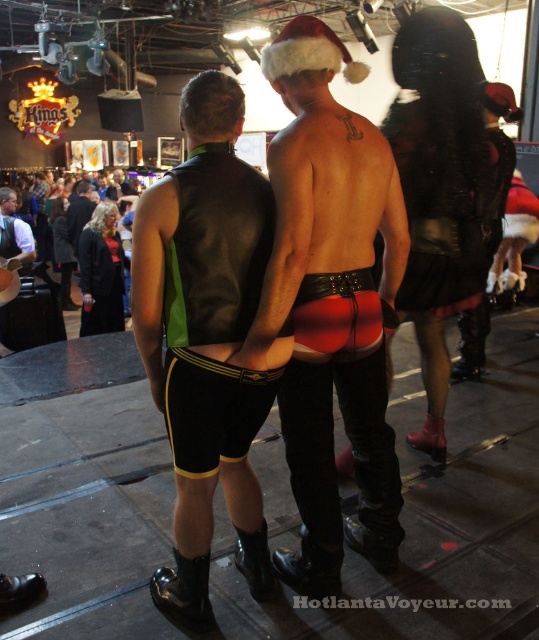
Question: Does shiny leather shorts at center have a smaller size compared to black leather vest at center?

Choices:
 (A) no
 (B) yes

Answer: (A)

Question: Is shiny leather shorts at center positioned before black leather vest at center?

Choices:
 (A) no
 (B) yes

Answer: (A)

Question: Which point is farther from the camera taking this photo?

Choices:
 (A) (233, 428)
 (B) (307, 589)

Answer: (B)

Question: Can you confirm if shiny leather shorts at center is thinner than black leather vest at center?

Choices:
 (A) yes
 (B) no

Answer: (B)